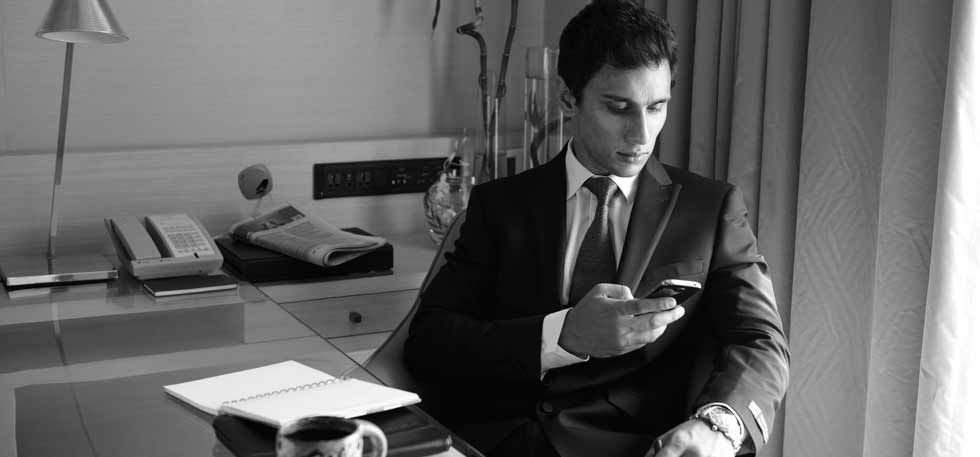
Image resolution: width=980 pixels, height=457 pixels. I want to click on newspaper, so click(309, 236).